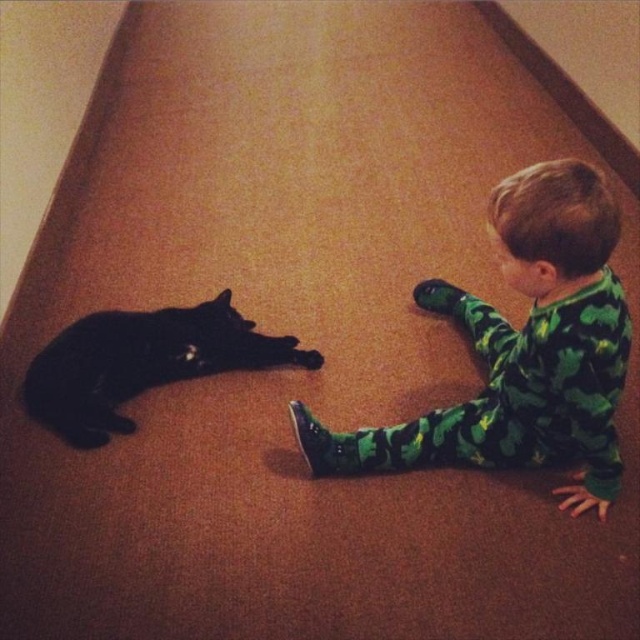
You are a parent trying to locate your child and their pet cat in the living room. You see the green camouflage pajamas at lower right and the green matte paw at lower center. Which one is higher up in the image?

The green camouflage pajamas at lower right is taller than green matte paw at lower center, so the green camouflage pajamas at lower right is higher up in the image.

You are a toy placed on the carpet between the green camouflage pajamas at lower right and the black fur cat at left. Which object is closer to you?

The black fur cat at left is closer to you because the green camouflage pajamas at lower right is much taller than the black fur cat at left, implying it is farther away.

You are a parent observing your child and cat in the living room. You notice the black fur cat at left and the green matte paw at lower center. Which object is closer to you?

The green matte paw at lower center is closer to you because it is above the black fur cat at left, meaning the cat is further away.